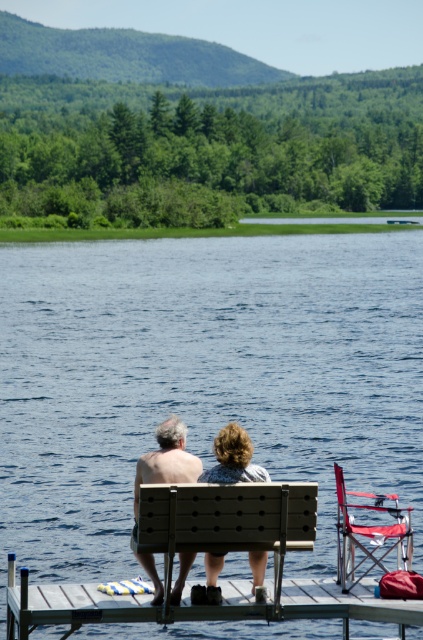
What do you see at coordinates (74, 605) in the screenshot? The height and width of the screenshot is (640, 423). I see `wooden dock at lower center` at bounding box center [74, 605].

The height and width of the screenshot is (640, 423). What do you see at coordinates (74, 605) in the screenshot?
I see `wooden dock at lower center` at bounding box center [74, 605].

Find the location of `wooden dock at lower center`. wooden dock at lower center is located at coordinates (74, 605).

Measure the distance from wooden bench at center to matte wood bench at center.

wooden bench at center is 27.94 inches from matte wood bench at center.

Looking at this image, can you confirm if wooden bench at center is shorter than matte wood bench at center?

In fact, wooden bench at center may be taller than matte wood bench at center.

What do you see at coordinates (227, 520) in the screenshot?
I see `wooden bench at center` at bounding box center [227, 520].

Find the location of `wooden bench at center`. wooden bench at center is located at coordinates (227, 520).

Is point (235, 518) positioned before point (224, 464)?

That is True.

Is wooden bench at center positioned behind matte gray shorts at center?

No, it is in front of matte gray shorts at center.

Which is in front, point (305, 502) or point (208, 602)?

Positioned in front is point (305, 502).

This screenshot has width=423, height=640. In order to click on wooden bench at center in this screenshot , I will do `click(227, 520)`.